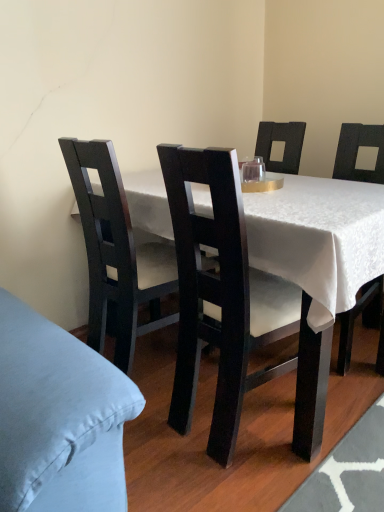
Question: Can you confirm if matte black chair at center, which is the first chair from right to left, is thinner than transparent glass at center?

Choices:
 (A) yes
 (B) no

Answer: (B)

Question: Does matte black chair at center, which is the first chair from right to left, have a greater height compared to transparent glass at center?

Choices:
 (A) yes
 (B) no

Answer: (A)

Question: Is matte black chair at center, which is the first chair from right to left, to the right of transparent glass at center from the viewer's perspective?

Choices:
 (A) no
 (B) yes

Answer: (A)

Question: Is matte black chair at center, which is the first chair from right to left, at the left side of transparent glass at center?

Choices:
 (A) yes
 (B) no

Answer: (A)

Question: Considering the relative positions of matte black chair at center, which is the first chair from right to left, and transparent glass at center in the image provided, is matte black chair at center, which is the first chair from right to left, in front of transparent glass at center?

Choices:
 (A) yes
 (B) no

Answer: (A)

Question: Which is correct: transparent glass at center is inside matte black chair at center, which is the first chair from right to left, or outside of it?

Choices:
 (A) outside
 (B) inside

Answer: (A)

Question: Relative to matte black chair at center, marked as the second chair in a left-to-right arrangement, is transparent glass at center in front or behind?

Choices:
 (A) front
 (B) behind

Answer: (B)

Question: Is transparent glass at center wider or thinner than matte black chair at center, marked as the second chair in a left-to-right arrangement?

Choices:
 (A) thin
 (B) wide

Answer: (A)

Question: From a real-world perspective, is transparent glass at center physically located above or below matte black chair at center, which is the first chair from right to left?

Choices:
 (A) below
 (B) above

Answer: (B)

Question: From a real-world perspective, is transparent glass at center above or below matte black chair at center, which is the first chair from left to right?

Choices:
 (A) below
 (B) above

Answer: (B)

Question: Choose the correct answer: Is transparent glass at center inside matte black chair at center, which is the first chair from left to right, or outside it?

Choices:
 (A) outside
 (B) inside

Answer: (A)

Question: Looking at the image, does transparent glass at center seem bigger or smaller compared to matte black chair at center, which is the first chair from left to right?

Choices:
 (A) small
 (B) big

Answer: (A)

Question: Considering the relative positions of transparent glass at center and matte black chair at center, positioned as the 2th chair in right-to-left order, in the image provided, is transparent glass at center to the left or to the right of matte black chair at center, positioned as the 2th chair in right-to-left order,?

Choices:
 (A) right
 (B) left

Answer: (A)

Question: Is matte black chair at center, which is the first chair from left to right, inside or outside of matte black table at center?

Choices:
 (A) outside
 (B) inside

Answer: (B)

Question: From a real-world perspective, is matte black chair at center, positioned as the 2th chair in right-to-left order, physically located above or below matte black table at center?

Choices:
 (A) above
 (B) below

Answer: (A)